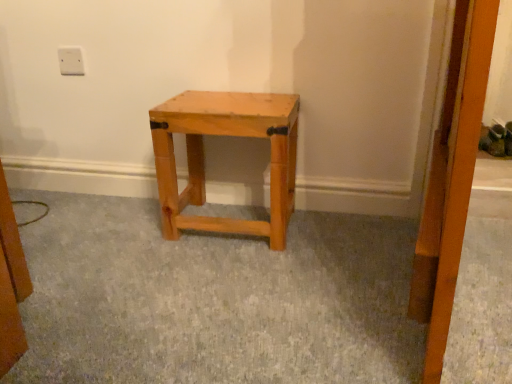
Identify the location of vacant space to the left of natural wood stool at center. The image size is (512, 384). (119, 229).